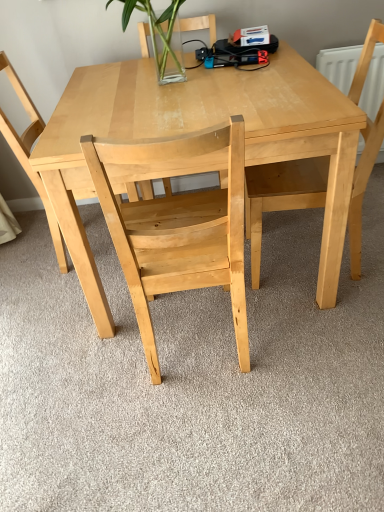
In order to click on vacant point to the left of natural wood chair at center, the 2th chair viewed from the left in this screenshot , I will do `click(78, 375)`.